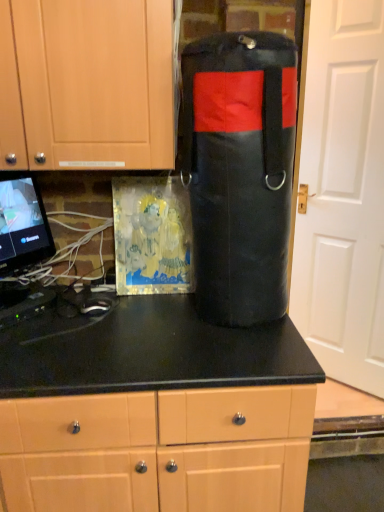
Question: From the image's perspective, is matte black countertop at center, acting as the second cabinetry starting from the top, located above or below black leather punching bag at center?

Choices:
 (A) above
 (B) below

Answer: (B)

Question: Considering the positions of point (258, 410) and point (206, 247), is point (258, 410) closer or farther from the camera than point (206, 247)?

Choices:
 (A) closer
 (B) farther

Answer: (A)

Question: Considering the real-world distances, which object is farthest from the matte black monitor at left?

Choices:
 (A) matte black countertop at center, acting as the second cabinetry starting from the top
 (B) matte wood cabinet at upper left, which ranks as the 1th cabinetry in top-to-bottom order
 (C) black plastic router at lower left
 (D) white matte door at right
 (E) black leather punching bag at center

Answer: (D)

Question: Which of these objects is positioned farthest from the black leather punching bag at center?

Choices:
 (A) black plastic router at lower left
 (B) matte black monitor at left
 (C) matte wood cabinet at upper left, which ranks as the 1th cabinetry in top-to-bottom order
 (D) matte black countertop at center, acting as the second cabinetry starting from the top
 (E) white matte door at right

Answer: (E)